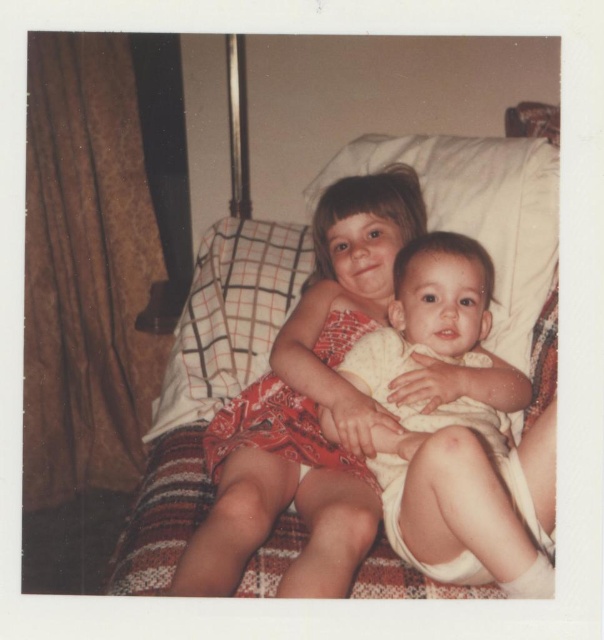
Question: Which object appears closest to the camera in this image?

Choices:
 (A) matte red dress at center
 (B) white cloth diaper at center
 (C) white checkered pillow at upper left

Answer: (B)

Question: Which object is farther from the camera taking this photo?

Choices:
 (A) matte red dress at center
 (B) white checkered pillow at upper left

Answer: (B)

Question: Is matte red dress at center closer to camera compared to white checkered pillow at upper left?

Choices:
 (A) no
 (B) yes

Answer: (B)

Question: Which point is farther to the camera?

Choices:
 (A) white cloth diaper at center
 (B) white checkered pillow at upper left
 (C) matte red dress at center

Answer: (B)

Question: Is matte red dress at center smaller than white checkered pillow at upper left?

Choices:
 (A) no
 (B) yes

Answer: (A)

Question: Is white cloth diaper at center to the left of white checkered pillow at upper left from the viewer's perspective?

Choices:
 (A) yes
 (B) no

Answer: (B)